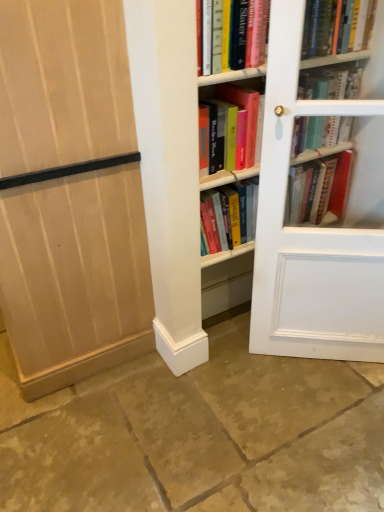
Question: Should I look upward or downward to see hardcover book at upper right, which appears as the second book when viewed from the right?

Choices:
 (A) down
 (B) up

Answer: (B)

Question: Is light wood paneling at left far away from white glass door at right?

Choices:
 (A) no
 (B) yes

Answer: (A)

Question: Is light wood paneling at left bigger than white glass door at right?

Choices:
 (A) no
 (B) yes

Answer: (B)

Question: Considering the relative positions of light wood paneling at left and white glass door at right in the image provided, is light wood paneling at left to the left of white glass door at right from the viewer's perspective?

Choices:
 (A) no
 (B) yes

Answer: (B)

Question: Can you confirm if light wood paneling at left is thinner than white glass door at right?

Choices:
 (A) no
 (B) yes

Answer: (A)

Question: Can you confirm if light wood paneling at left is smaller than white glass door at right?

Choices:
 (A) yes
 (B) no

Answer: (B)

Question: Is light wood paneling at left positioned with its back to white glass door at right?

Choices:
 (A) yes
 (B) no

Answer: (B)

Question: Does hardcover book at upper right, placed as the second book when sorted from left to right, appear on the right side of brown stone floor at lower center?

Choices:
 (A) yes
 (B) no

Answer: (A)

Question: Is hardcover book at upper right, placed as the second book when sorted from left to right, behind brown stone floor at lower center?

Choices:
 (A) no
 (B) yes

Answer: (B)

Question: Does hardcover book at upper right, placed as the second book when sorted from left to right, contain brown stone floor at lower center?

Choices:
 (A) no
 (B) yes

Answer: (A)

Question: Is hardcover book at upper right, which appears as the second book when viewed from the right, outside of brown stone floor at lower center?

Choices:
 (A) no
 (B) yes

Answer: (B)

Question: Can you confirm if hardcover book at upper right, placed as the second book when sorted from left to right, is thinner than brown stone floor at lower center?

Choices:
 (A) no
 (B) yes

Answer: (B)

Question: Could you tell me if hardcover book at upper right, which appears as the second book when viewed from the right, is facing brown stone floor at lower center?

Choices:
 (A) no
 (B) yes

Answer: (A)

Question: Can you confirm if hardcover book at center, placed as the 3th book when sorted from left to right, is taller than brown stone floor at lower center?

Choices:
 (A) yes
 (B) no

Answer: (A)